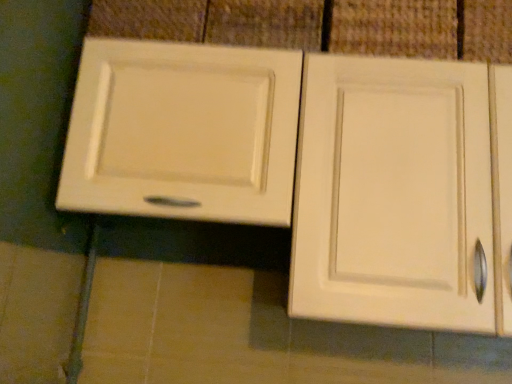
What do you see at coordinates (395, 28) in the screenshot? I see `white matte cabinet door at upper center` at bounding box center [395, 28].

Image resolution: width=512 pixels, height=384 pixels. I want to click on white matte cabinet door at upper center, so click(395, 28).

The width and height of the screenshot is (512, 384). Describe the element at coordinates (302, 167) in the screenshot. I see `matte white cabinet at upper left` at that location.

Where is `matte white cabinet at upper left`? matte white cabinet at upper left is located at coordinates (302, 167).

Where is `white matte cabinet door at upper center`? This screenshot has height=384, width=512. white matte cabinet door at upper center is located at coordinates (395, 28).

Visually, is matte white cabinet at upper left positioned to the left or to the right of white matte cabinet door at upper center?

matte white cabinet at upper left is positioned on white matte cabinet door at upper center's left side.

Does matte white cabinet at upper left lie in front of white matte cabinet door at upper center?

Yes, the depth of matte white cabinet at upper left is less than that of white matte cabinet door at upper center.

Considering the positions of point (150, 198) and point (379, 51), is point (150, 198) closer or farther from the camera than point (379, 51)?

Point (150, 198) is closer to the camera than point (379, 51).

From the image's perspective, does matte white cabinet at upper left appear higher than white matte cabinet door at upper center?

No, from the image's perspective, matte white cabinet at upper left is not above white matte cabinet door at upper center.

From a real-world perspective, which object rests below the other?

matte white cabinet at upper left, from a real-world perspective.

Based on the photo, looking at their sizes, would you say matte white cabinet at upper left is wider or thinner than white matte cabinet door at upper center?

In the image, matte white cabinet at upper left appears to be wider than white matte cabinet door at upper center.

Considering the sizes of matte white cabinet at upper left and white matte cabinet door at upper center in the image, is matte white cabinet at upper left taller or shorter than white matte cabinet door at upper center?

In the image, matte white cabinet at upper left appears to be taller than white matte cabinet door at upper center.

Between matte white cabinet at upper left and white matte cabinet door at upper center, which one has smaller size?

With smaller size is white matte cabinet door at upper center.

From the picture: Could white matte cabinet door at upper center be considered to be inside matte white cabinet at upper left?

Yes.

Does matte white cabinet at upper left touch white matte cabinet door at upper center?

No, matte white cabinet at upper left is not in contact with white matte cabinet door at upper center.

Consider the image. Is matte white cabinet at upper left aimed at white matte cabinet door at upper center?

No, matte white cabinet at upper left is not facing towards white matte cabinet door at upper center.

Where is `tile above the matte white cabinet at upper left (from a real-world perspective)`? The width and height of the screenshot is (512, 384). tile above the matte white cabinet at upper left (from a real-world perspective) is located at coordinates (395, 28).

Which object is positioned more to the left, white matte cabinet door at upper center or matte white cabinet at upper left?

matte white cabinet at upper left.

Which is in front, white matte cabinet door at upper center or matte white cabinet at upper left?

matte white cabinet at upper left is in front.

Considering the positions of point (433, 34) and point (360, 229), is point (433, 34) closer or farther from the camera than point (360, 229)?

Clearly, point (433, 34) is more distant from the camera than point (360, 229).

From the image's perspective, between white matte cabinet door at upper center and matte white cabinet at upper left, who is located below?

matte white cabinet at upper left.

From a real-world perspective, is white matte cabinet door at upper center above or below matte white cabinet at upper left?

Clearly, from a real-world perspective, white matte cabinet door at upper center is above matte white cabinet at upper left.

Between white matte cabinet door at upper center and matte white cabinet at upper left, which one has smaller width?

With smaller width is white matte cabinet door at upper center.

Considering the sizes of white matte cabinet door at upper center and matte white cabinet at upper left in the image, is white matte cabinet door at upper center taller or shorter than matte white cabinet at upper left?

Clearly, white matte cabinet door at upper center is shorter compared to matte white cabinet at upper left.

Considering the relative sizes of white matte cabinet door at upper center and matte white cabinet at upper left in the image provided, is white matte cabinet door at upper center smaller than matte white cabinet at upper left?

Yes.

Is matte white cabinet at upper left surrounded by white matte cabinet door at upper center?

No, matte white cabinet at upper left is not inside white matte cabinet door at upper center.

Is white matte cabinet door at upper center positioned far away from matte white cabinet at upper left?

No, there isn't a large distance between white matte cabinet door at upper center and matte white cabinet at upper left.

Could you tell me if white matte cabinet door at upper center is facing matte white cabinet at upper left?

Yes, white matte cabinet door at upper center is turned towards matte white cabinet at upper left.

Can you tell me how much white matte cabinet door at upper center and matte white cabinet at upper left differ in facing direction?

The angle between the facing direction of white matte cabinet door at upper center and the facing direction of matte white cabinet at upper left is 2.07 degrees.

I want to click on tile that is behind the matte white cabinet at upper left, so click(395, 28).

Where is `cabinetry on the left of white matte cabinet door at upper center`? The width and height of the screenshot is (512, 384). cabinetry on the left of white matte cabinet door at upper center is located at coordinates (302, 167).

The height and width of the screenshot is (384, 512). In the image, there is a white matte cabinet door at upper center. Identify the location of cabinetry below it (from the image's perspective). (302, 167).